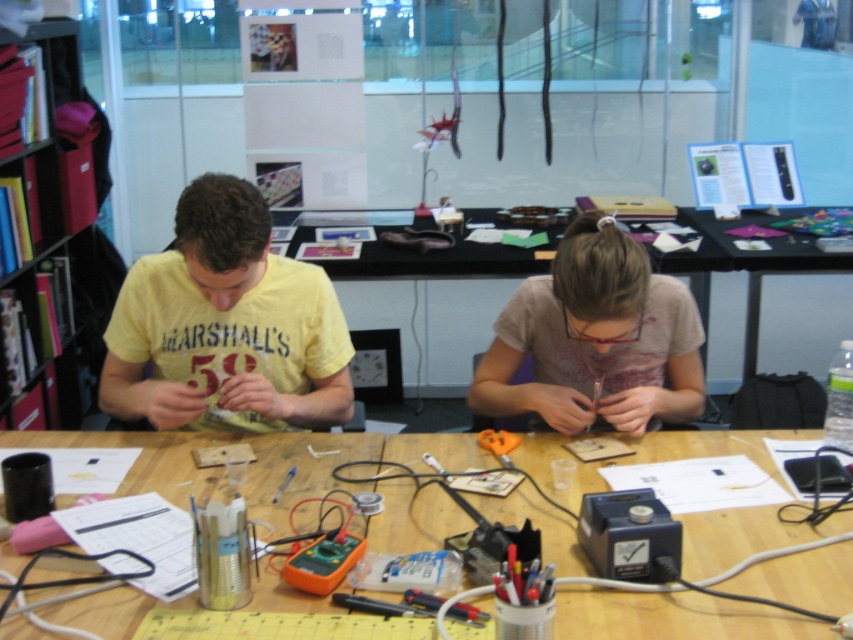
Question: Which of the following is the farthest from the observer?

Choices:
 (A) clear plastic ruler at center
 (B) black plastic table at upper right
 (C) orange plastic tool at center
 (D) wooden table at center

Answer: (B)

Question: Estimate the real-world distances between objects in this image. Which object is closer to the orange plastic tool at center?

Choices:
 (A) yellow cotton shirt at left
 (B) clear plastic ruler at center
 (C) black plastic table at upper right
 (D) red cardboard bookshelf at left

Answer: (B)

Question: Does red cardboard bookshelf at left have a lesser width compared to black plastic table at upper right?

Choices:
 (A) no
 (B) yes

Answer: (B)

Question: In this image, where is red cardboard bookshelf at left located relative to black plastic table at upper right?

Choices:
 (A) right
 (B) left

Answer: (B)

Question: Which point is closer to the camera?

Choices:
 (A) yellow cotton shirt at left
 (B) wooden table at center
 (C) clear plastic ruler at center

Answer: (B)

Question: Can you confirm if yellow cotton shirt at left is positioned below pink fabric shirt at center?

Choices:
 (A) yes
 (B) no

Answer: (B)